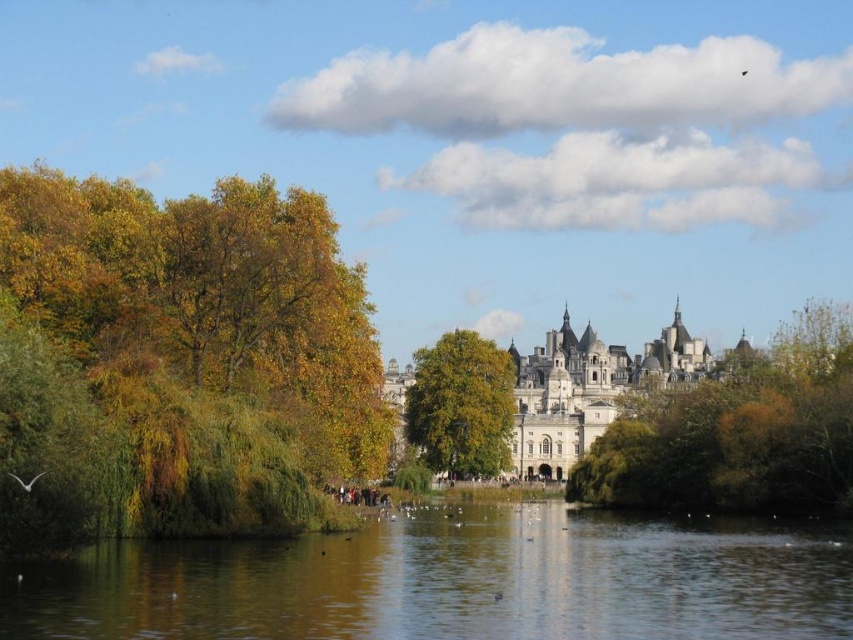
Does green reflective water at lower center have a lesser width compared to golden textured tree at center?

Incorrect, green reflective water at lower center's width is not less than golden textured tree at center's.

This screenshot has width=853, height=640. What do you see at coordinates (456, 582) in the screenshot?
I see `green reflective water at lower center` at bounding box center [456, 582].

Identify the location of green reflective water at lower center. This screenshot has width=853, height=640. (456, 582).

Does white stone castle at center have a lesser height compared to golden textured tree at center?

No, white stone castle at center is not shorter than golden textured tree at center.

Does white stone castle at center have a smaller size compared to golden textured tree at center?

No, white stone castle at center is not smaller than golden textured tree at center.

You are a GUI agent. You are given a task and a screenshot of the screen. Output one action in this format:
    pyautogui.click(x=<x>, y=<y>)
    Task: Click on the white stone castle at center
    The image size is (853, 640).
    Given the screenshot: What is the action you would take?
    pyautogui.click(x=589, y=388)

Locate an element on the screen. This screenshot has height=640, width=853. white stone castle at center is located at coordinates (589, 388).

Does green reflective water at lower center have a larger size compared to green leafy tree at center?

Incorrect, green reflective water at lower center is not larger than green leafy tree at center.

Between point (776, 529) and point (695, 504), which one is positioned in front?

Positioned in front is point (776, 529).

Find the location of a particular element. Image resolution: width=853 pixels, height=640 pixels. green reflective water at lower center is located at coordinates (456, 582).